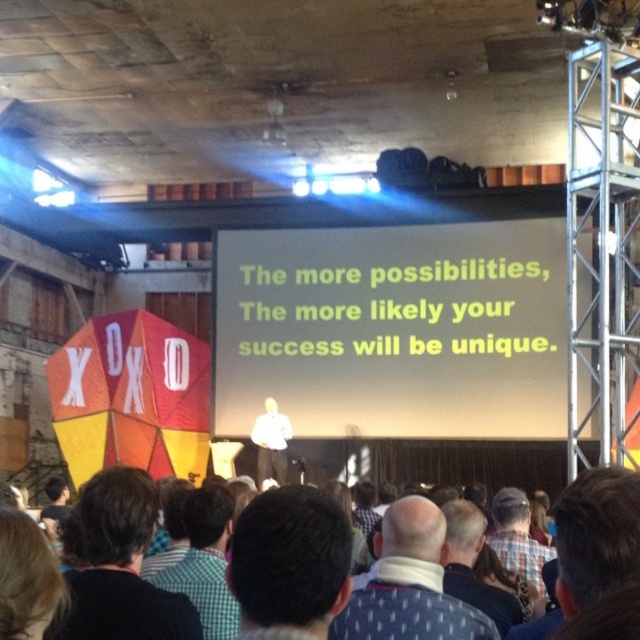
You are an event planner observing the presentation. You need to determine which object at center is smaller in size between the brown hair at center and the white fabric at center. Which one is it?

The brown hair at center has a smaller size compared to white fabric at center, so the brown hair at center is the smaller one.

What are the coordinates of the white matte projection screen at center in the image?

The white matte projection screen at center is located at coordinates point (394, 330).

You are a photographer at the back of the room. You want to take a photo of the blonde hair at lower left without the white matte projection screen at center blocking the view. Is this possible?

The blonde hair at lower left is behind the white matte projection screen at center, so you cannot take a photo of the blonde hair at lower left without the white matte projection screen at center blocking the view.